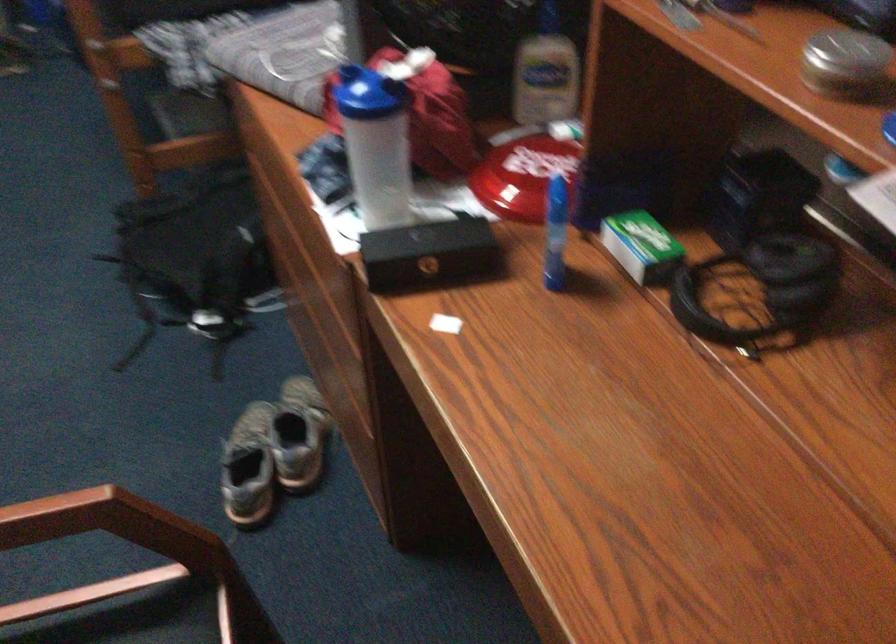
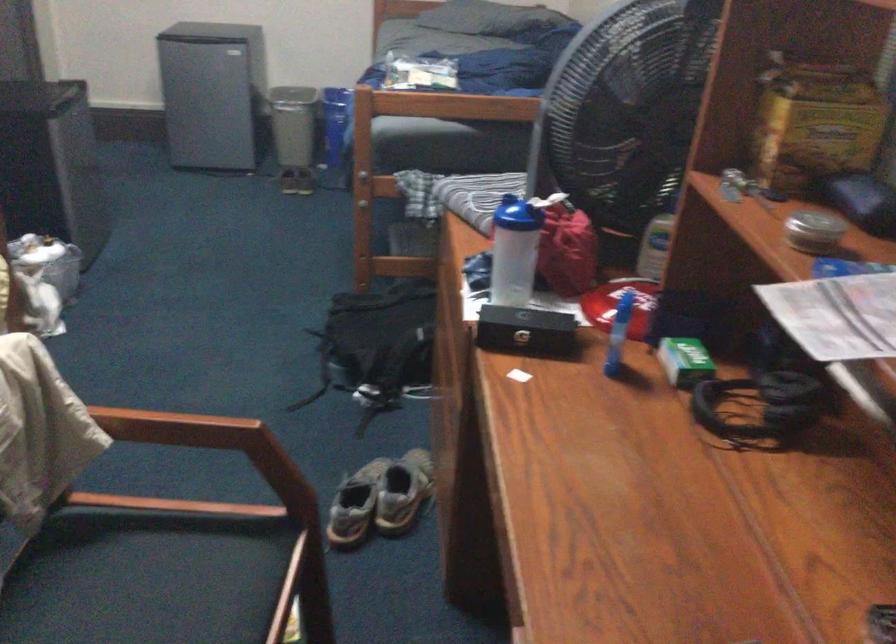
Where in the second image is the point corresponding to point 365,100 from the first image?

(510, 214)